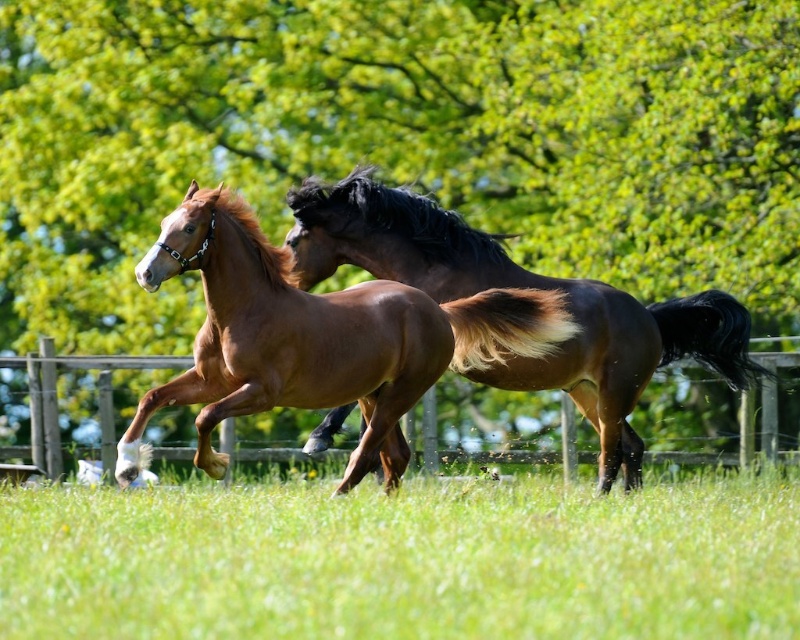
Does green leafy tree at upper center have a greater width compared to green grass at center?

Yes.

Is point (498, 177) positioned in front of point (397, 612)?

That is False.

The height and width of the screenshot is (640, 800). In order to click on green leafy tree at upper center in this screenshot , I will do `click(398, 140)`.

Which of these two, green leafy tree at upper center or wooden fence at center, stands taller?

green leafy tree at upper center

Is green leafy tree at upper center wider than wooden fence at center?

Correct, the width of green leafy tree at upper center exceeds that of wooden fence at center.

Which is in front, point (676, 128) or point (230, 442)?

Positioned in front is point (230, 442).

Identify the location of green leafy tree at upper center. The image size is (800, 640). (398, 140).

Does shiny brown horse at center have a lesser width compared to wooden fence at center?

Indeed, shiny brown horse at center has a lesser width compared to wooden fence at center.

Who is more distant from viewer, (401, 440) or (110, 429)?

Positioned behind is point (110, 429).

Locate an element on the screen. Image resolution: width=800 pixels, height=640 pixels. shiny brown horse at center is located at coordinates (318, 339).